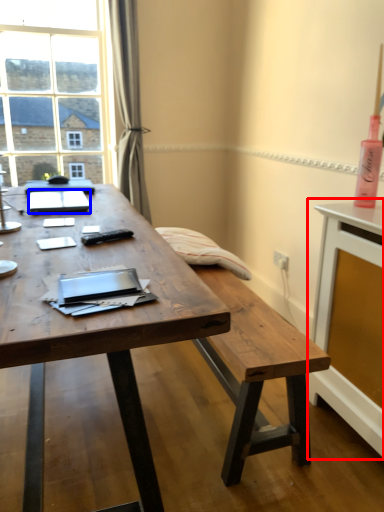
Question: Among these objects, which one is farthest to the camera, computer desk (highlighted by a red box) or notebook (highlighted by a blue box)?

Choices:
 (A) computer desk
 (B) notebook

Answer: (B)